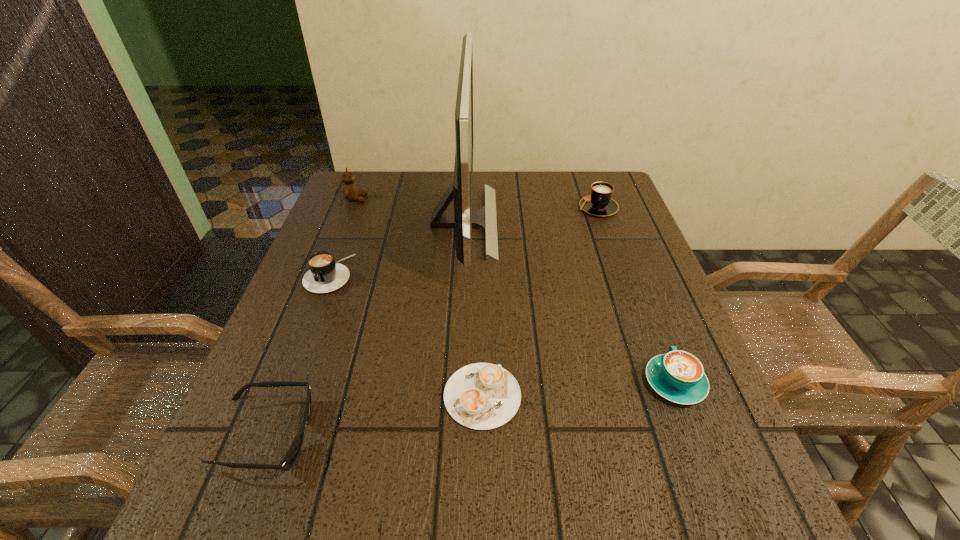
Locate an element on the screen. This screenshot has width=960, height=540. monitor is located at coordinates (463, 219).

Image resolution: width=960 pixels, height=540 pixels. What are the coordinates of `teddy bear` in the screenshot? It's located at (350, 191).

Where is `the farthest cappuccino`? Image resolution: width=960 pixels, height=540 pixels. the farthest cappuccino is located at coordinates point(599,203).

Where is `the leftmost cappuccino`? This screenshot has height=540, width=960. the leftmost cappuccino is located at coordinates (325, 275).

I want to click on the second shortest cappuccino, so click(x=678, y=376).

You are a GUI agent. You are given a task and a screenshot of the screen. Output one action in this format:
    pyautogui.click(x=<x>, y=<y>)
    Task: Click on the sunglasses
    The width and height of the screenshot is (960, 540).
    Given the screenshot: What is the action you would take?
    pos(289,459)

The height and width of the screenshot is (540, 960). I want to click on the shortest cappuccino, so click(x=482, y=396).

Identify the location of the second cappuccino from left to right. The image size is (960, 540). (482, 396).

Find the location of `vacant space located on the screen side of the monitor`. vacant space located on the screen side of the monitor is located at coordinates (631, 222).

The height and width of the screenshot is (540, 960). Find the location of `vacant region located 0.250m at the face of the teddy bear`. vacant region located 0.250m at the face of the teddy bear is located at coordinates (456, 199).